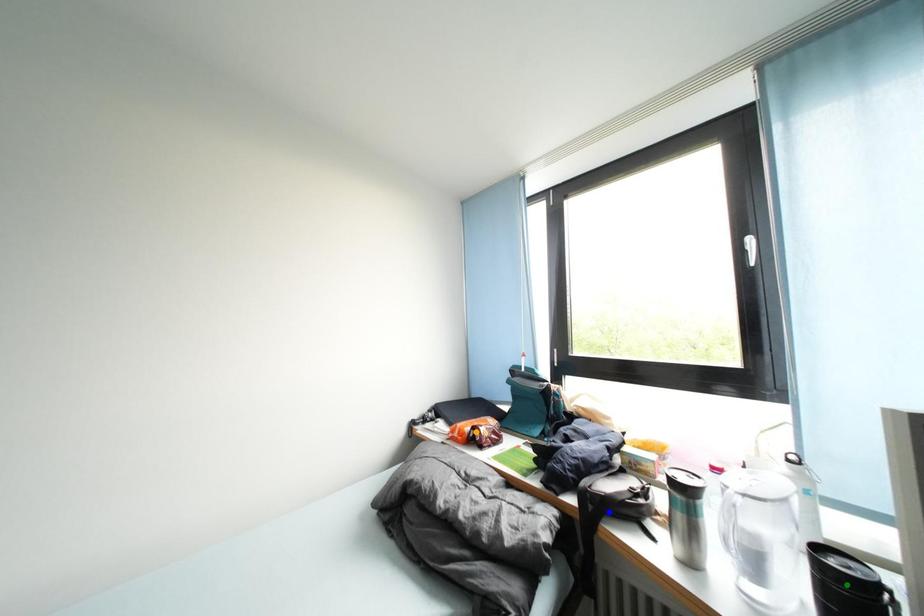
Order these from farthest to nearest:
A) blue point
B) orange point
C) green point

orange point < blue point < green point